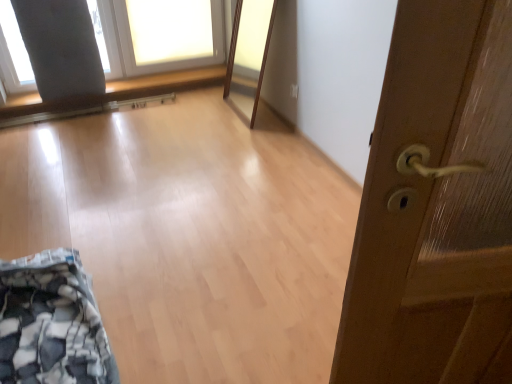
Question: Would you say white fabric at upper left is outside wooden door handle at right?

Choices:
 (A) yes
 (B) no

Answer: (A)

Question: Could you tell me if white fabric at upper left is turned towards wooden door handle at right?

Choices:
 (A) yes
 (B) no

Answer: (A)

Question: Is there a large distance between white fabric at upper left and wooden door handle at right?

Choices:
 (A) yes
 (B) no

Answer: (A)

Question: Is the surface of white fabric at upper left in direct contact with wooden door handle at right?

Choices:
 (A) yes
 (B) no

Answer: (B)

Question: Does white fabric at upper left have a lesser height compared to wooden door handle at right?

Choices:
 (A) no
 (B) yes

Answer: (B)

Question: From a real-world perspective, is white fabric at upper left physically below wooden door handle at right?

Choices:
 (A) yes
 (B) no

Answer: (A)

Question: From a real-world perspective, is wooden door handle at right located beneath white fabric at upper left?

Choices:
 (A) yes
 (B) no

Answer: (B)

Question: Is wooden door handle at right at the right side of white fabric at upper left?

Choices:
 (A) no
 (B) yes

Answer: (B)

Question: Does wooden door handle at right have a larger size compared to white fabric at upper left?

Choices:
 (A) yes
 (B) no

Answer: (B)

Question: From a real-world perspective, is wooden door handle at right positioned over white fabric at upper left based on gravity?

Choices:
 (A) no
 (B) yes

Answer: (B)

Question: Can you confirm if wooden door handle at right is shorter than white fabric at upper left?

Choices:
 (A) no
 (B) yes

Answer: (A)

Question: From the image's perspective, is wooden door handle at right on white fabric at upper left?

Choices:
 (A) no
 (B) yes

Answer: (A)

Question: Is wooden door handle at right in front of or behind white fabric at upper left in the image?

Choices:
 (A) front
 (B) behind

Answer: (A)